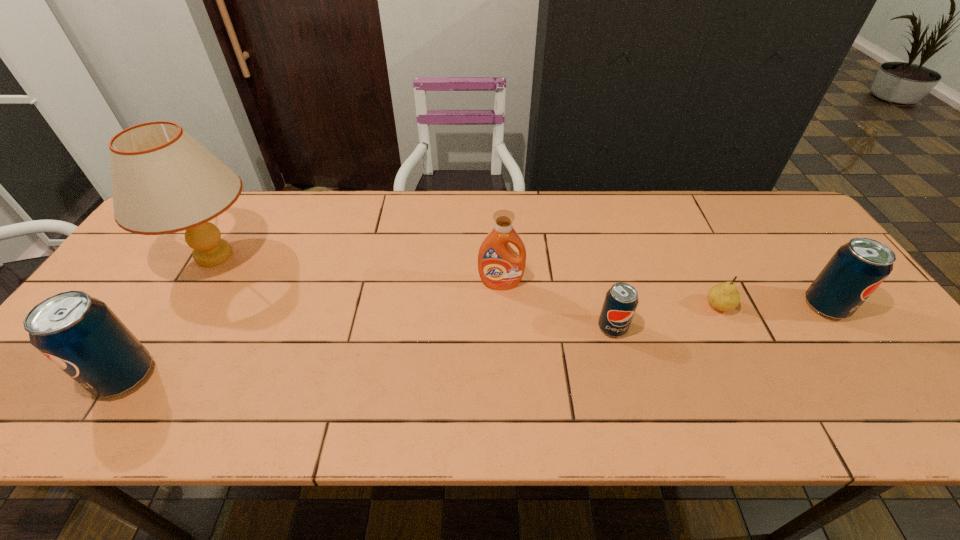
The image size is (960, 540). Identify the location of soda can that is the third closest one to the third object from left to right. (80, 334).

At what (x,y) coordinates should I click in order to perform the action: click on vacant space that satisfies the following two spatial constraints: 1. on the back side of the leftmost soda can; 2. on the right side of the lampshade. Please return your answer as a coordinate pair (x, y). This screenshot has height=540, width=960. Looking at the image, I should click on (202, 255).

This screenshot has width=960, height=540. I want to click on vacant space that satisfies the following two spatial constraints: 1. on the back side of the rightmost soda can; 2. on the left side of the leftmost soda can, so click(169, 306).

You are a GUI agent. You are given a task and a screenshot of the screen. Output one action in this format:
    pyautogui.click(x=<x>, y=<y>)
    Task: Click on the free location that satisfies the following two spatial constraints: 1. on the front-facing side of the pear; 2. on the left side of the detergent
    This screenshot has height=540, width=960.
    Given the screenshot: What is the action you would take?
    pyautogui.click(x=502, y=306)